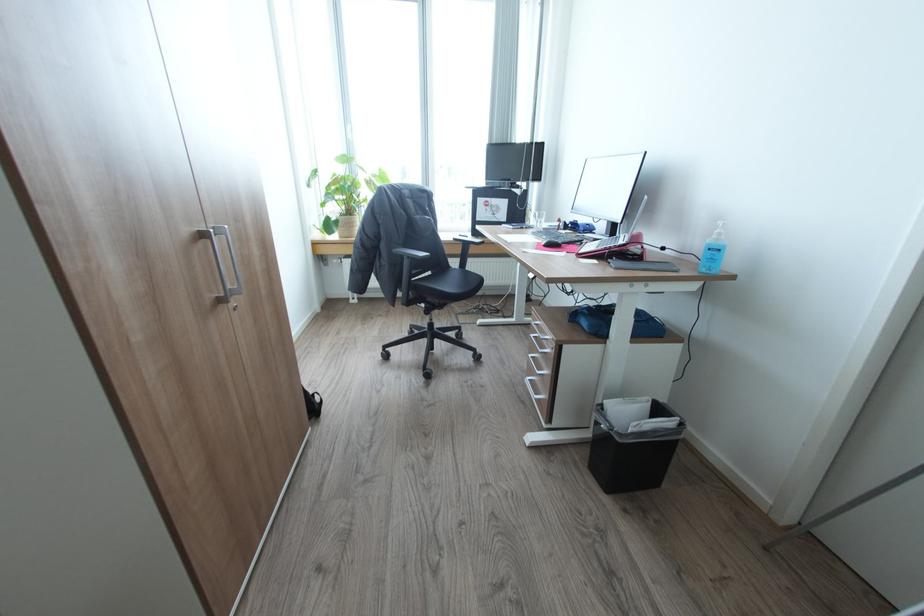
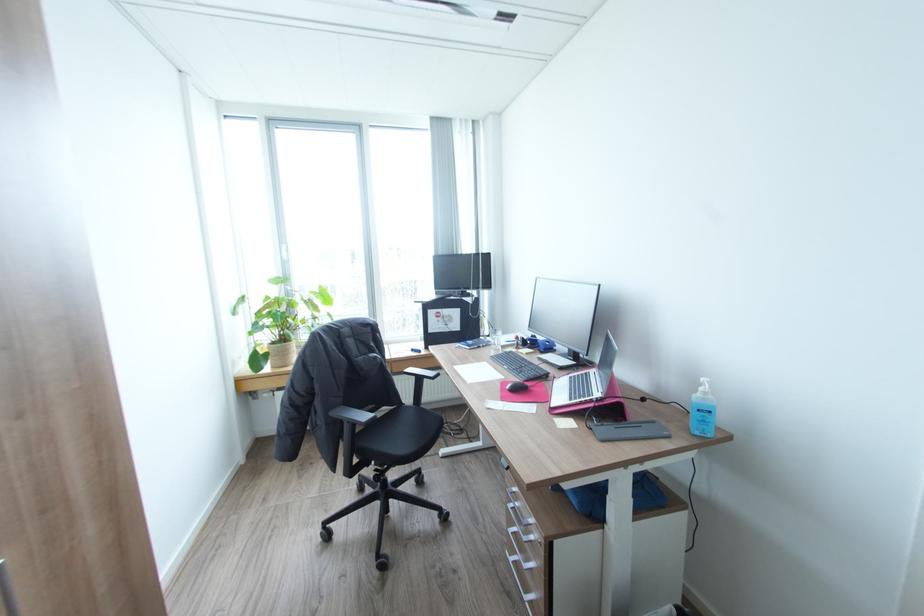
Find the pixel in the second image that matches (x=412, y=257) in the first image.

(354, 422)